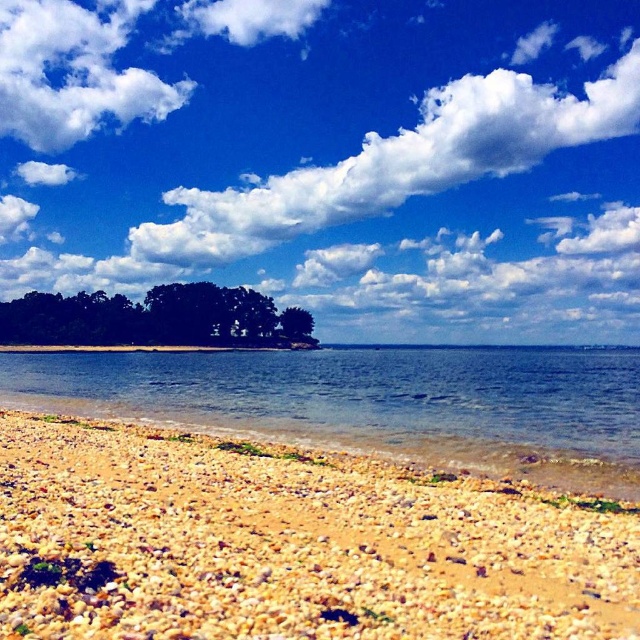
Question: Considering the real-world distances, which object is closest to the green matte tree at center?

Choices:
 (A) green leafy trees at center
 (B) white fluffy cloud at upper center

Answer: (A)

Question: Is green leafy trees at center positioned in front of green matte tree at center?

Choices:
 (A) yes
 (B) no

Answer: (A)

Question: Does clear blue water at center have a greater width compared to green leafy trees at center?

Choices:
 (A) no
 (B) yes

Answer: (B)

Question: Can you confirm if brown gravelly sand at lower left is smaller than green matte tree at center?

Choices:
 (A) yes
 (B) no

Answer: (A)

Question: Among these points, which one is nearest to the camera?

Choices:
 (A) [x=420, y=378]
 (B) [x=64, y=324]
 (C) [x=532, y=97]

Answer: (A)

Question: Among these points, which one is farthest from the camera?

Choices:
 (A) (218, 321)
 (B) (515, 163)
 (C) (340, 420)
 (D) (182, 465)

Answer: (B)